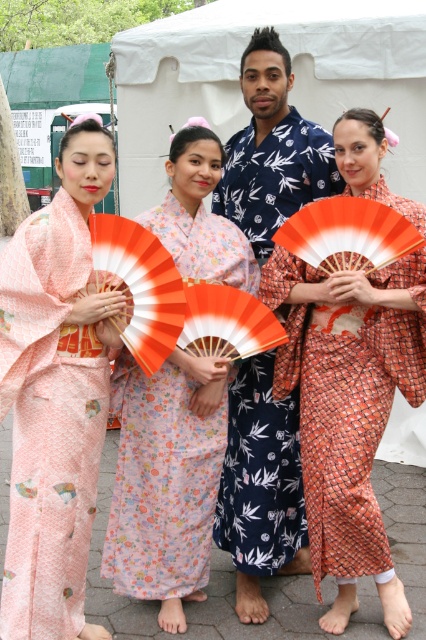
At what (x,y) coordinates should I click in order to perform the action: click on matte peach kimono at left. Please return your answer as a coordinate pair (x, y). Looking at the image, I should click on (54, 396).

Between matte peach kimono at left and blue printed kimono at center, which one appears on the right side from the viewer's perspective?

Positioned to the right is blue printed kimono at center.

This screenshot has height=640, width=426. What do you see at coordinates (54, 396) in the screenshot?
I see `matte peach kimono at left` at bounding box center [54, 396].

I want to click on matte peach kimono at left, so click(54, 396).

Who is more distant from viewer, (x=149, y=413) or (x=291, y=147)?

The point (x=291, y=147) is behind.

Who is more forward, (x=175, y=141) or (x=241, y=563)?

Point (x=175, y=141) is more forward.

Between point (143, 440) and point (268, 540), which one is positioned in front?

Point (143, 440)

Image resolution: width=426 pixels, height=640 pixels. I want to click on floral silk kimono at center, so click(166, 481).

Does matte peach kimono at left have a greater height compared to floral silk kimono at center?

Yes, matte peach kimono at left is taller than floral silk kimono at center.

Between matte peach kimono at left and floral silk kimono at center, which one has less height?

With less height is floral silk kimono at center.

Does point (9, 531) lie behind point (195, 435)?

That is False.

This screenshot has width=426, height=640. Identify the location of matte peach kimono at left. (54, 396).